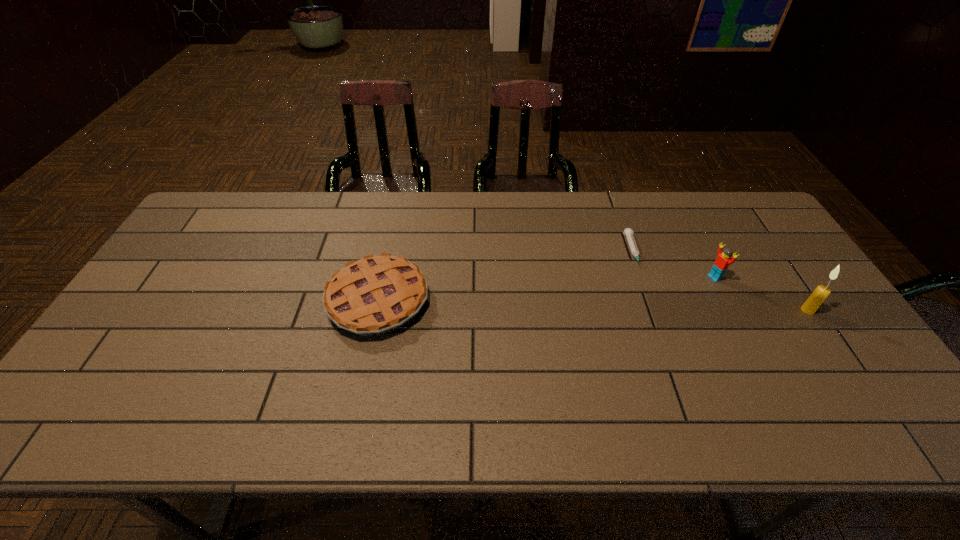
Identify the location of vacant area situated 0.100m on the face of the second tallest object. Image resolution: width=960 pixels, height=540 pixels. (685, 293).

Where is `free spot located on the face of the second tallest object`? free spot located on the face of the second tallest object is located at coordinates (608, 332).

Locate an element on the screen. The height and width of the screenshot is (540, 960). vacant space located 0.180m on the face of the second tallest object is located at coordinates (664, 303).

Find the location of `vacant space located at the needle end of the syringe`. vacant space located at the needle end of the syringe is located at coordinates (681, 388).

The image size is (960, 540). In order to click on blank space located 0.200m at the needle end of the syringe in this screenshot , I will do `click(659, 324)`.

The image size is (960, 540). In order to click on free point located 0.200m at the needle end of the syringe in this screenshot , I will do `click(659, 324)`.

The height and width of the screenshot is (540, 960). Find the location of `object present at the far edge`. object present at the far edge is located at coordinates (628, 232).

Locate an element on the screen. object located at the right edge is located at coordinates (811, 305).

Identify the location of vacant space at the far edge of the desktop. Image resolution: width=960 pixels, height=540 pixels. (381, 212).

Find the location of a particular element. The width and height of the screenshot is (960, 540). vacant region at the near edge of the desktop is located at coordinates (606, 369).